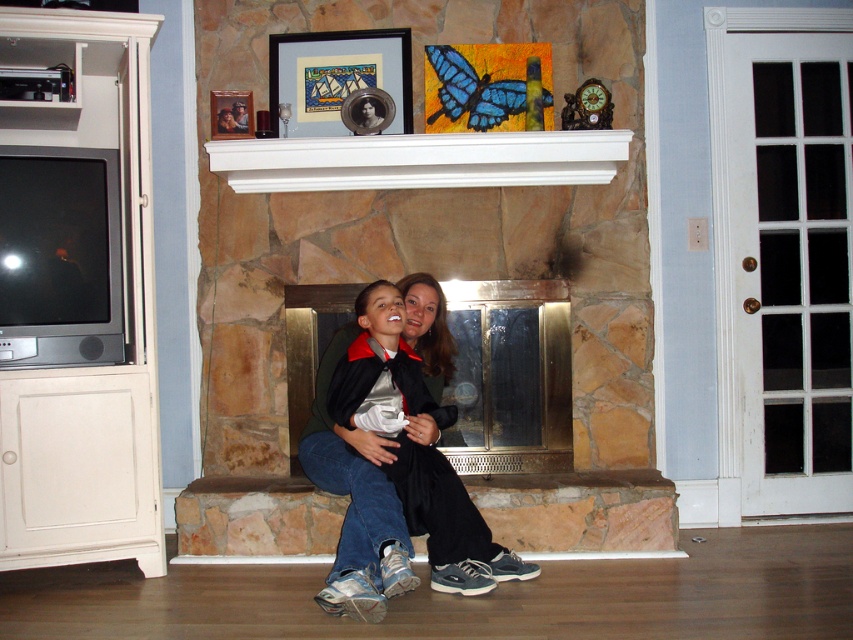
Is white wood mantle at upper center below matte plastic picture frame at upper center?

Correct, white wood mantle at upper center is located below matte plastic picture frame at upper center.

Can you confirm if white wood mantle at upper center is thinner than matte plastic picture frame at upper center?

No.

At what (x,y) coordinates should I click in order to perform the action: click on white wood mantle at upper center. Please return your answer as a coordinate pair (x, y). This screenshot has width=853, height=640. Looking at the image, I should click on (419, 161).

Locate an element on the screen. The image size is (853, 640). white wood mantle at upper center is located at coordinates (x=419, y=161).

Between stone fireplace at center and matte black jacket at center, which one has less height?

stone fireplace at center

Is stone fireplace at center wider than matte black jacket at center?

Correct, the width of stone fireplace at center exceeds that of matte black jacket at center.

Image resolution: width=853 pixels, height=640 pixels. I want to click on stone fireplace at center, so click(421, 157).

Between stone fireplace at center and wooden picture frame at upper center, which one has less height?

Standing shorter between the two is wooden picture frame at upper center.

Is stone fireplace at center above wooden picture frame at upper center?

Incorrect, stone fireplace at center is not positioned above wooden picture frame at upper center.

The height and width of the screenshot is (640, 853). What are the coordinates of `stone fireplace at center` in the screenshot? It's located at (421, 157).

Identify the location of stone fireplace at center. (421, 157).